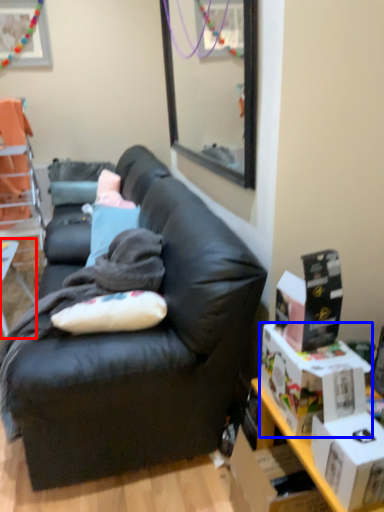
Question: Which of the following is the closest to the observer, table (highlighted by a red box) or box (highlighted by a blue box)?

Choices:
 (A) table
 (B) box

Answer: (B)